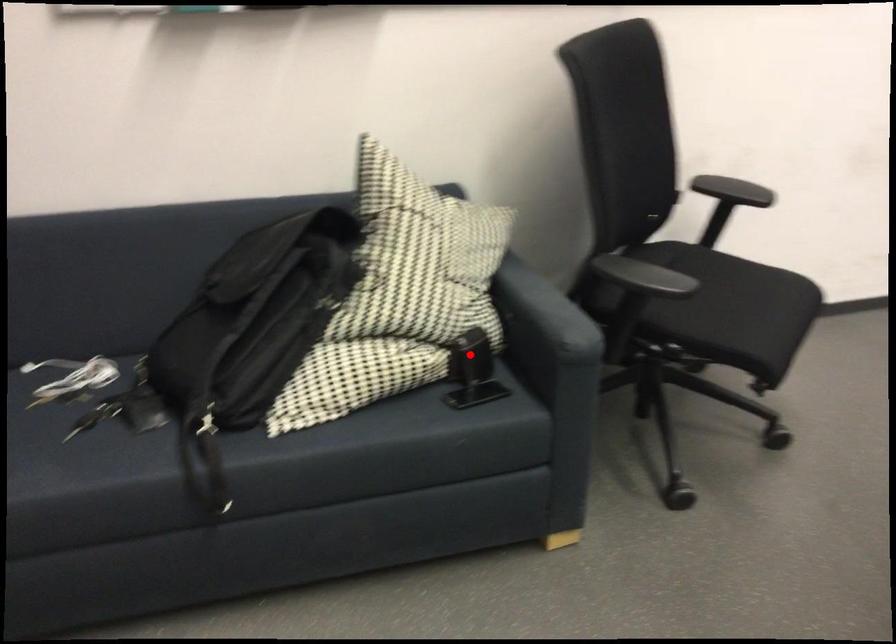
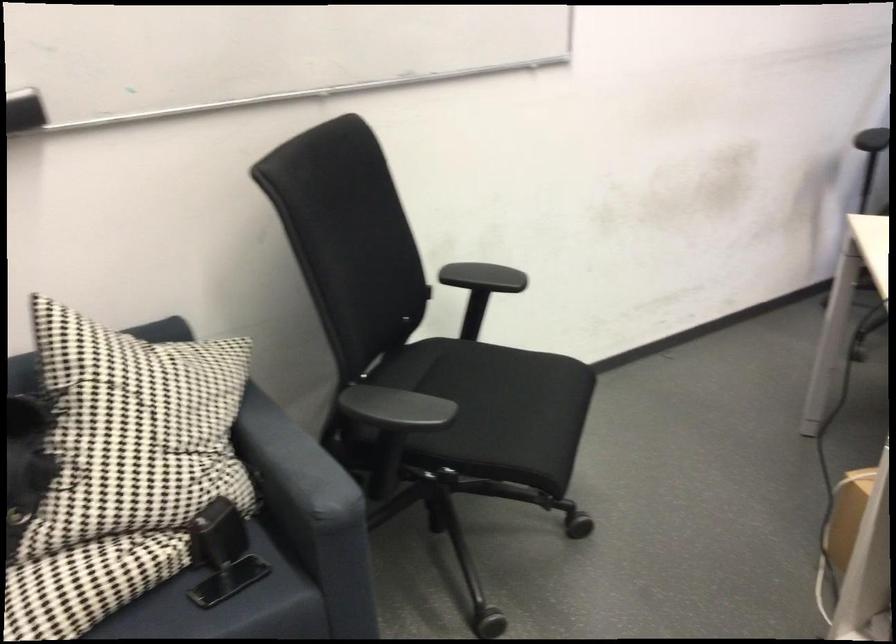
Question: I am providing you with two images of the same scene from different viewpoints. In image1, a red point is highlighted. Considering the same 3D point in image2, which of the following is correct?

Choices:
 (A) It is closer
 (B) It is farther

Answer: (A)